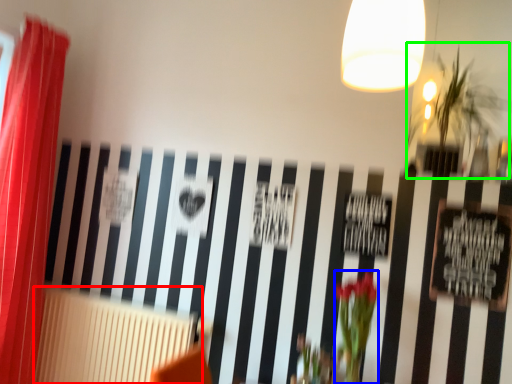
Question: Considering the real-world distances, which object is farthest from radiator (highlighted by a red box)? floral arrangement (highlighted by a blue box) or plant (highlighted by a green box)?

Choices:
 (A) floral arrangement
 (B) plant

Answer: (B)